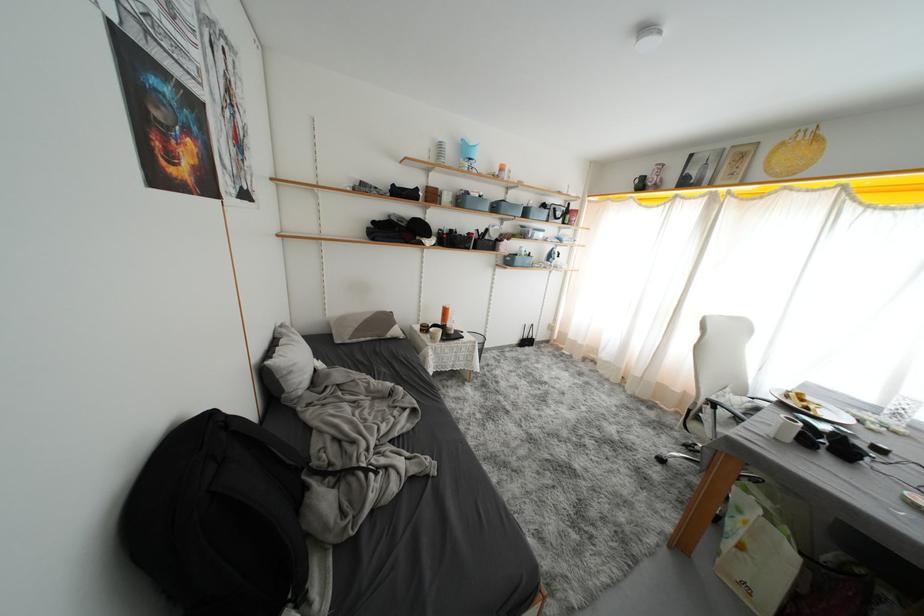
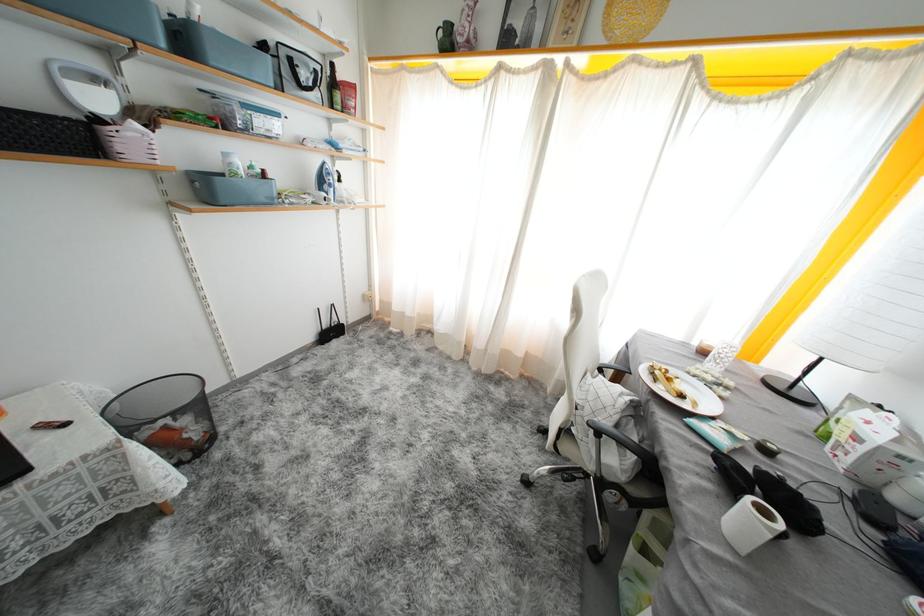
Where in the second image is the point corresponding to (532,217) from the first image?

(190, 44)